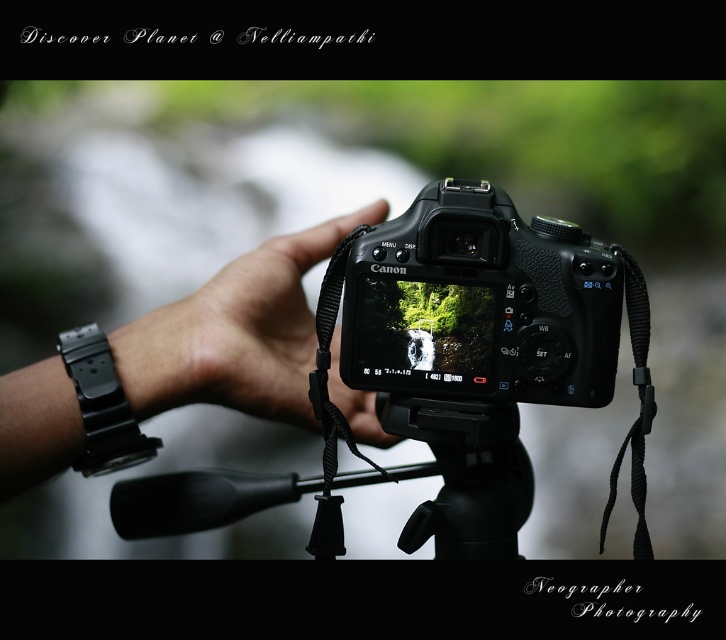
You are a photographer setting up your equipment. You have a black plastic camera at center and a black rubber tripod at center. Which object is taller?

The black plastic camera at center is taller than the black rubber tripod at center.

You are a photographer adjusting the camera settings. You notice two points on the camera screen. The first point is at coordinates point [530,278] and the second point is at point [208,304]. Which point is closer to the camera lens?

Point [530,278] is in front of point [208,304], so it is closer to the camera lens.

You are a photographer trying to adjust your Canon DSLR camera settings. You notice your black matte hand at center and the black rubber tripod at center. How far apart are these two objects in inches?

The black matte hand at center and black rubber tripod at center are 4.77 inches apart from each other.